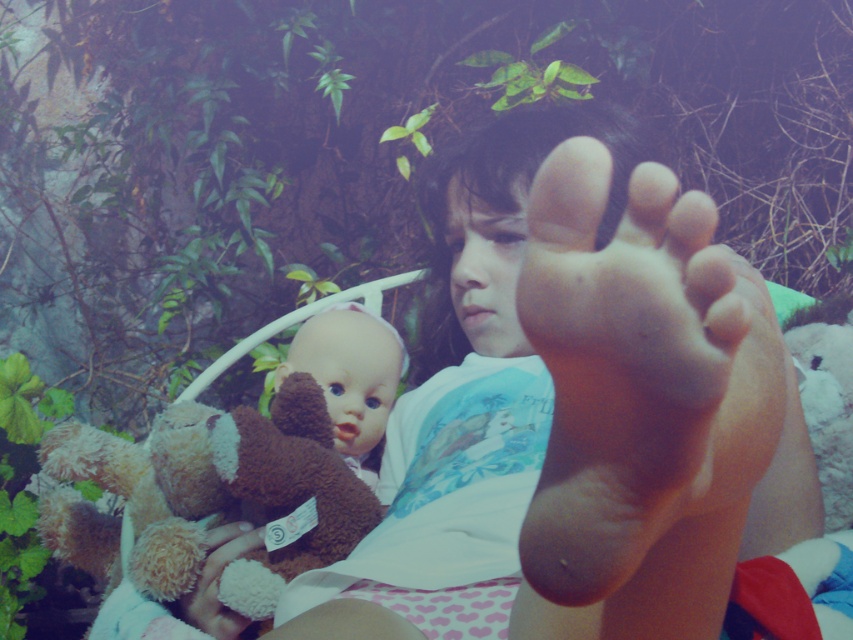
You are a photographer analyzing the image. The coordinates point at a specific object. Which object is located at the coordinates point (619,365)?

The coordinates point (619,365) is on the skinny flesh toned foot at center.

The user is trying to determine which of the two teddy bears is bigger. They see a fuzzy brown teddy bear at lower left and a fluffy brown teddy bear at lower left. Which one is bigger?

The fuzzy brown teddy bear at lower left is larger in size than the fluffy brown teddy bear at lower left.